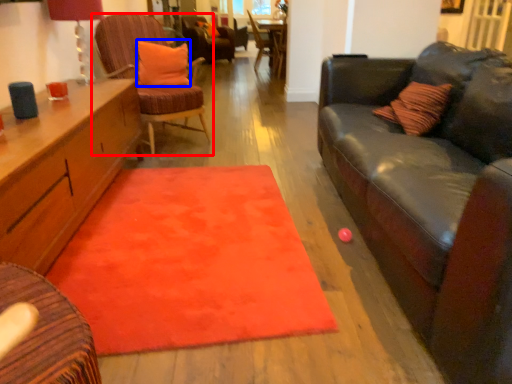
Question: Which object appears farthest to the camera in this image, chair (highlighted by a red box) or pillow (highlighted by a blue box)?

Choices:
 (A) chair
 (B) pillow

Answer: (B)